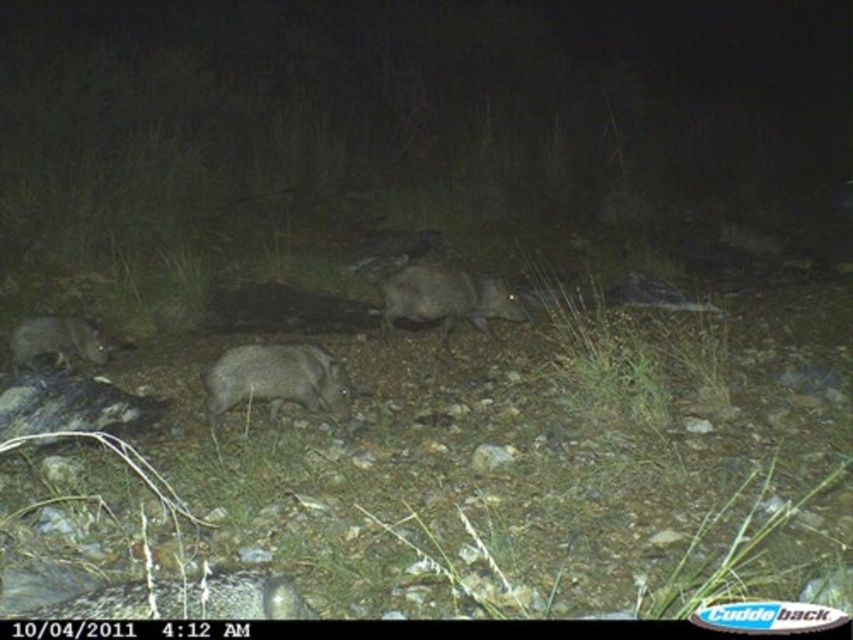
You are a wildlife photographer trying to capture a clear image of the gray fur animal at center and the gray furry boar at center. From your current position, which animal is closer to you?

The gray fur animal at center is closer to you because it is in front of the gray furry boar at center.

You are a wildlife researcher analyzing the night vision image captured at 4 AM. You see a gray fur animal at center represented by point [189,598]. What is the exact coordinate of the gray fur animal at center?

The gray fur animal at center is represented by point [189,598].

You are a wildlife photographer who wants to capture the gray fur animal at center and the gray fur animal at lower left in a single frame. Based on their sizes, which animal would require you to adjust your camera settings to ensure proper focus?

The gray fur animal at center is smaller than the gray fur animal at lower left, so you would need to adjust the camera settings to focus on the smaller one to ensure clarity.